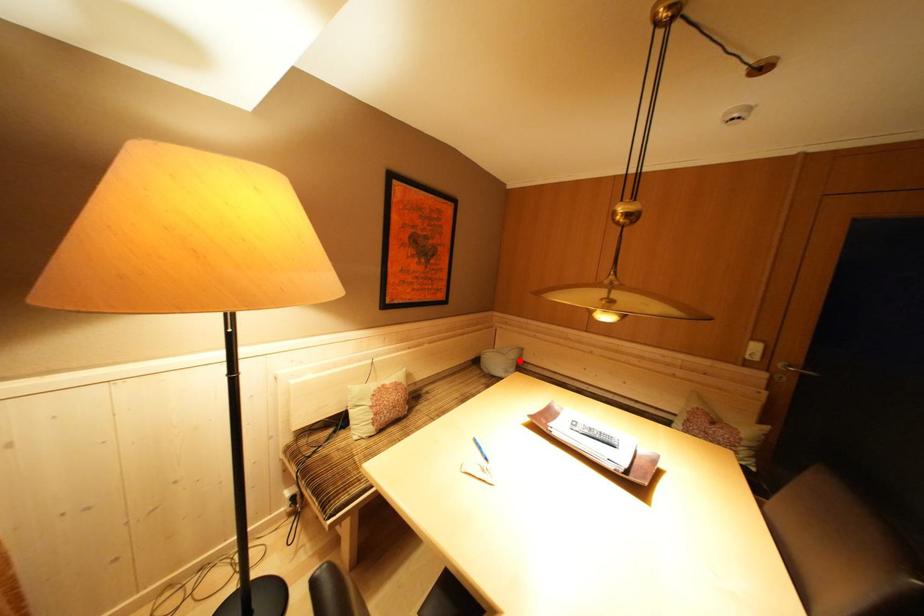
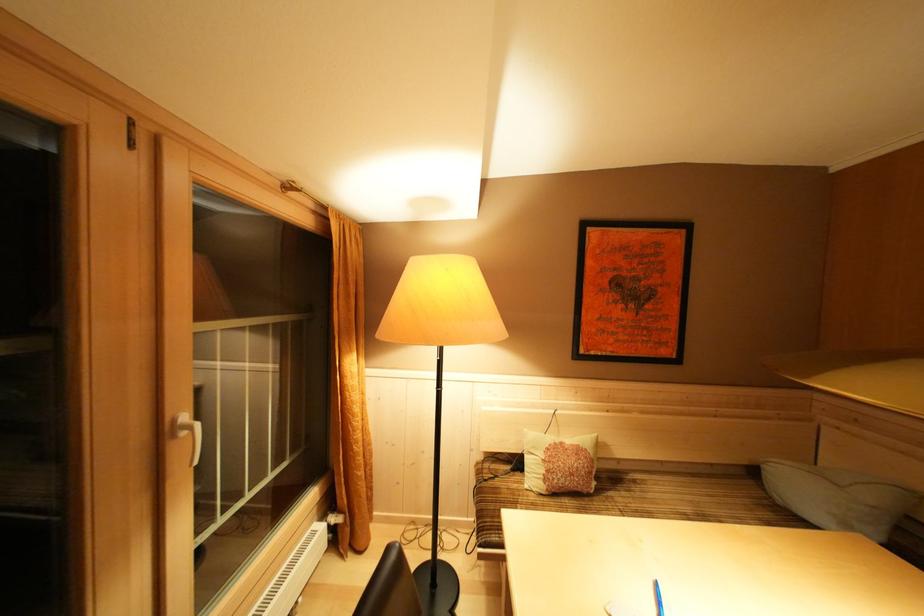
Find the pixel in the second image that matches the highlighted location in the first image.

(879, 503)